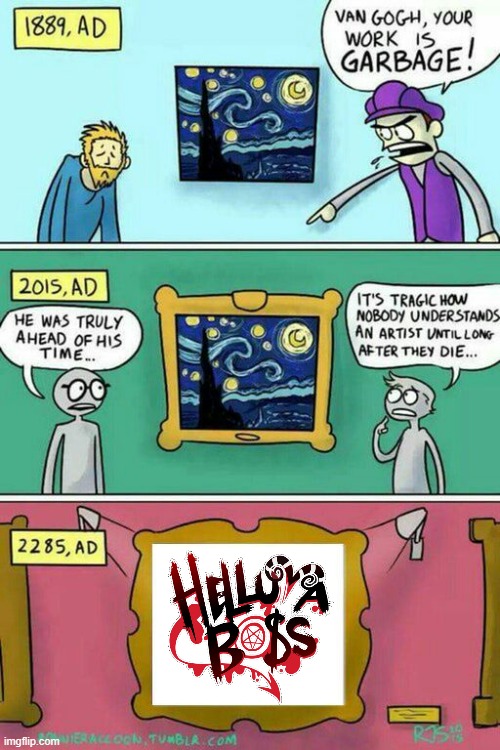
The image size is (500, 750). I want to click on picture frame, so click(342, 705), click(314, 436).